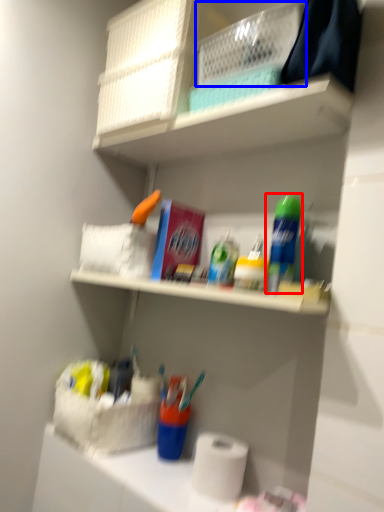
Question: Which object is closer to the camera taking this photo, cleaning product (highlighted by a red box) or basket (highlighted by a blue box)?

Choices:
 (A) cleaning product
 (B) basket

Answer: (B)